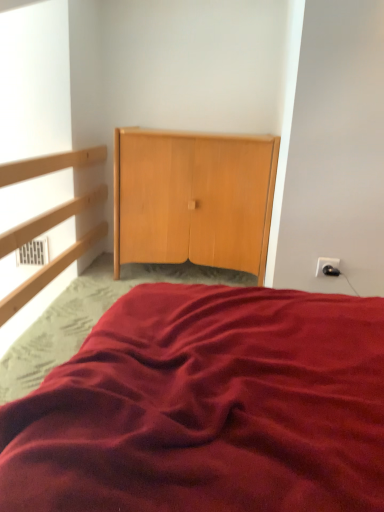
Question: Considering the relative positions of light wood dresser at center and black plastic outlet at upper right in the image provided, is light wood dresser at center behind black plastic outlet at upper right?

Choices:
 (A) no
 (B) yes

Answer: (B)

Question: Are light wood dresser at center and black plastic outlet at upper right located far from each other?

Choices:
 (A) no
 (B) yes

Answer: (A)

Question: Is light wood dresser at center in contact with black plastic outlet at upper right?

Choices:
 (A) yes
 (B) no

Answer: (B)

Question: Considering the relative sizes of light wood dresser at center and black plastic outlet at upper right in the image provided, is light wood dresser at center bigger than black plastic outlet at upper right?

Choices:
 (A) yes
 (B) no

Answer: (A)

Question: Can you confirm if light wood dresser at center is shorter than black plastic outlet at upper right?

Choices:
 (A) yes
 (B) no

Answer: (B)

Question: In terms of width, does burgundy satin bed at center look wider or thinner when compared to light wood dresser at center?

Choices:
 (A) thin
 (B) wide

Answer: (B)

Question: From a real-world perspective, relative to light wood dresser at center, is burgundy satin bed at center vertically above or below?

Choices:
 (A) below
 (B) above

Answer: (A)

Question: Considering their positions, is burgundy satin bed at center located in front of or behind light wood dresser at center?

Choices:
 (A) behind
 (B) front

Answer: (B)

Question: From the image's perspective, is burgundy satin bed at center above or below light wood dresser at center?

Choices:
 (A) below
 (B) above

Answer: (A)

Question: From a real-world perspective, is light wood dresser at center physically located above or below burgundy satin bed at center?

Choices:
 (A) above
 (B) below

Answer: (A)

Question: Is point 205,184 positioned closer to the camera than point 367,451?

Choices:
 (A) farther
 (B) closer

Answer: (A)

Question: Considering the positions of light wood dresser at center and burgundy satin bed at center in the image, is light wood dresser at center taller or shorter than burgundy satin bed at center?

Choices:
 (A) short
 (B) tall

Answer: (B)

Question: Is light wood dresser at center inside the boundaries of burgundy satin bed at center, or outside?

Choices:
 (A) outside
 (B) inside

Answer: (A)

Question: From the image's perspective, is burgundy satin bed at center located above or below black plastic outlet at upper right?

Choices:
 (A) above
 (B) below

Answer: (B)

Question: Considering the positions of point (274, 326) and point (336, 268), is point (274, 326) closer or farther from the camera than point (336, 268)?

Choices:
 (A) farther
 (B) closer

Answer: (B)